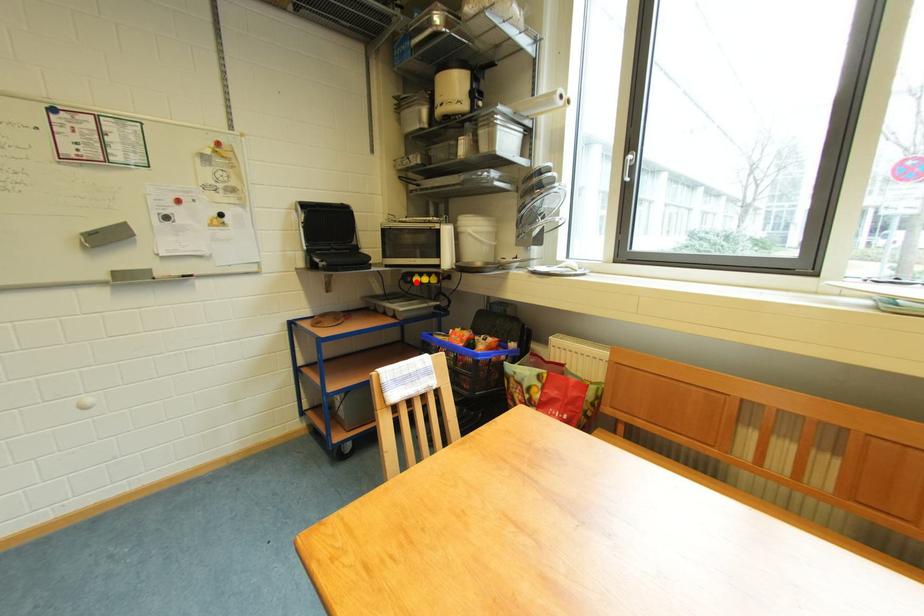
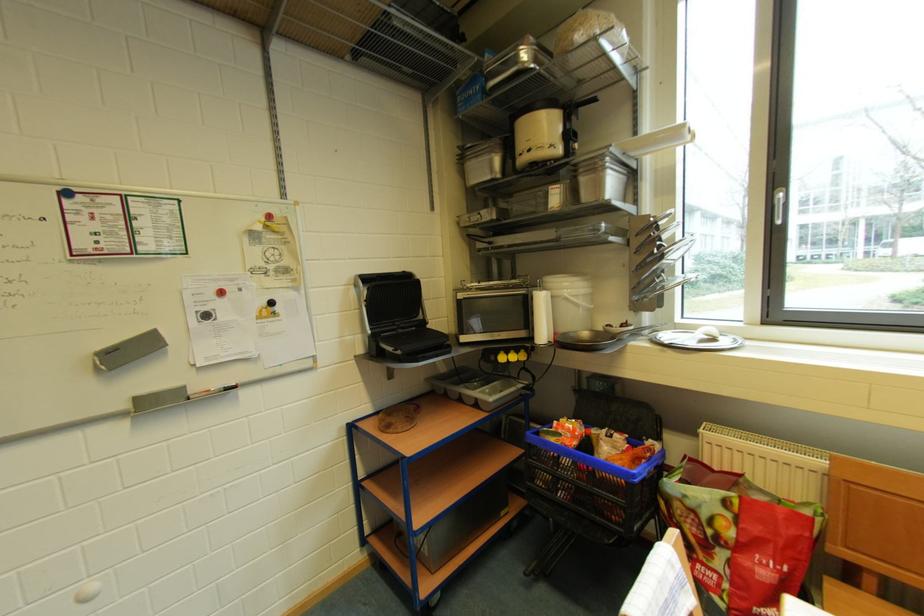
In the second image, find the point that corresponds to the highlighted location in the first image.

(500, 361)